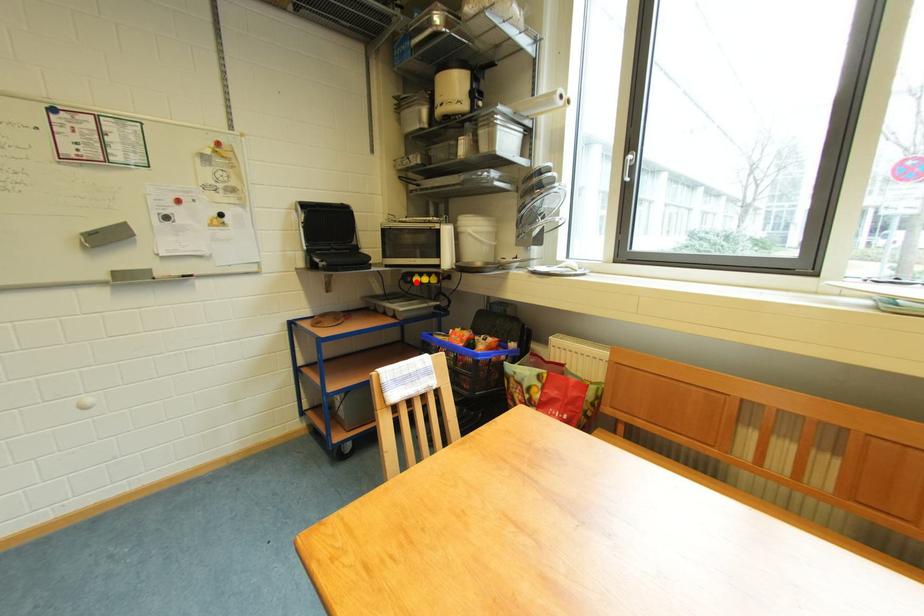
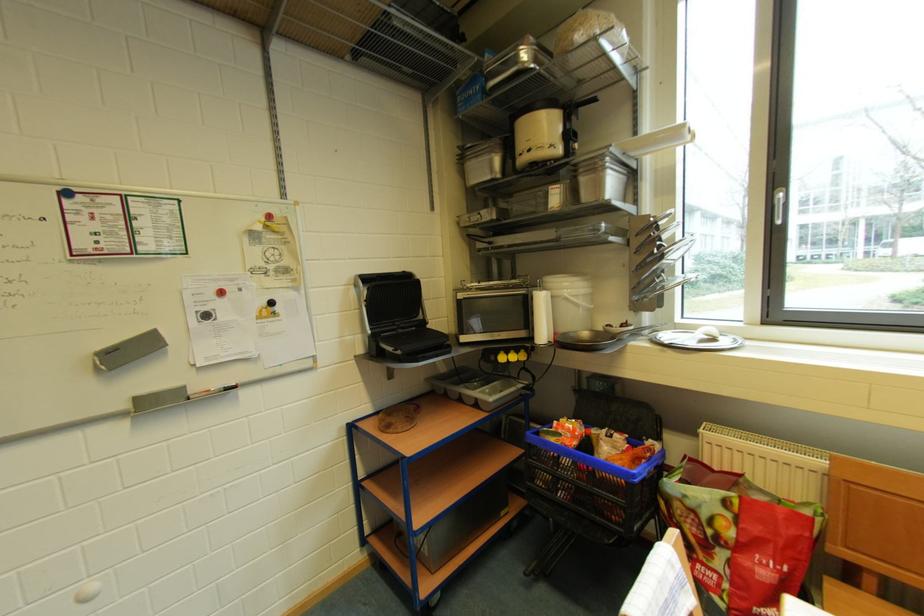
In the second image, find the point that corresponds to the highlighted location in the first image.

(500, 361)